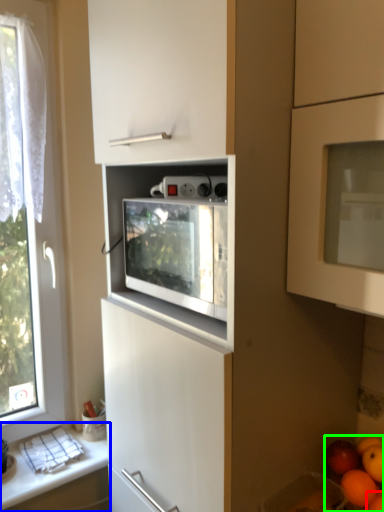
Question: Which object is the closest to the orange (highlighted by a red box)? Choose among these: countertop (highlighted by a blue box) or fruit (highlighted by a green box).

Choices:
 (A) countertop
 (B) fruit

Answer: (B)